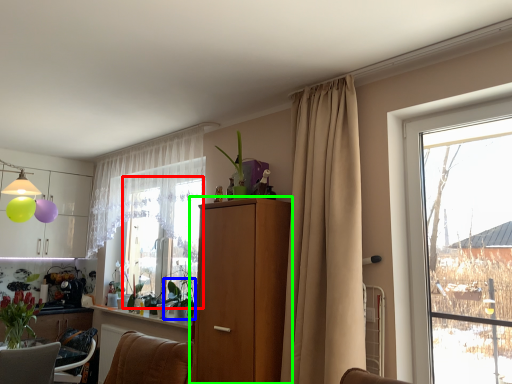
Question: Which object is the farthest from window screen (highlighted by a red box)? Choose among these: plant (highlighted by a blue box) or cabinetry (highlighted by a green box).

Choices:
 (A) plant
 (B) cabinetry

Answer: (B)